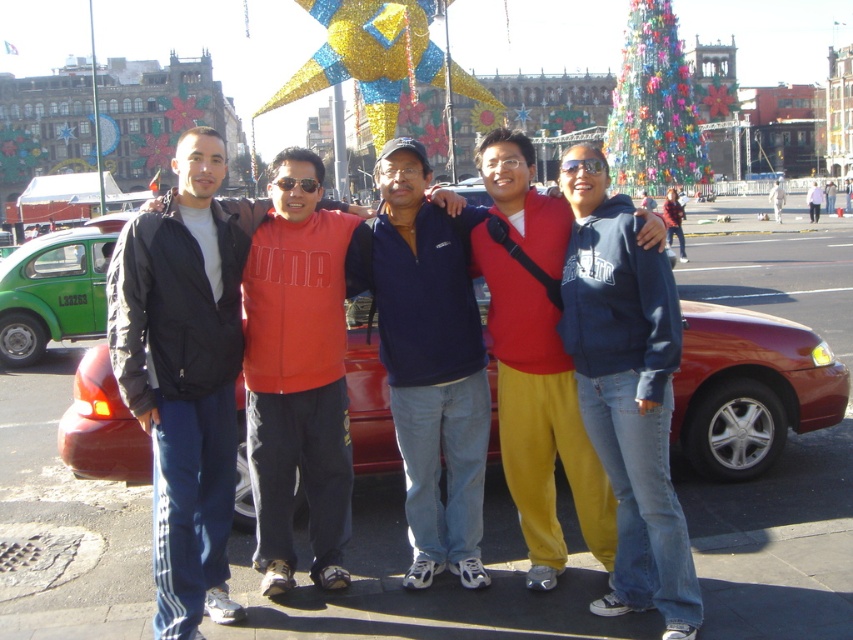
Question: Which object appears closest to the camera in this image?

Choices:
 (A) green matte taxi at left
 (B) red fleece jacket at center
 (C) black matte jacket at left

Answer: (C)

Question: Is green matte taxi at left further to camera compared to white matte jacket at center?

Choices:
 (A) yes
 (B) no

Answer: (B)

Question: Which object is closer to the camera taking this photo?

Choices:
 (A) black matte jacket at left
 (B) shiny red sedan at center
 (C) green matte taxi at left

Answer: (A)

Question: Is shiny red sedan at center closer to camera compared to white matte jacket at center?

Choices:
 (A) no
 (B) yes

Answer: (B)

Question: Which point is closer to the camera taking this photo?

Choices:
 (A) (102, 305)
 (B) (840, 413)
 (C) (508, 232)
 (D) (265, 211)

Answer: (C)

Question: Is shiny red sedan at center closer to the viewer compared to green matte taxi at left?

Choices:
 (A) yes
 (B) no

Answer: (A)